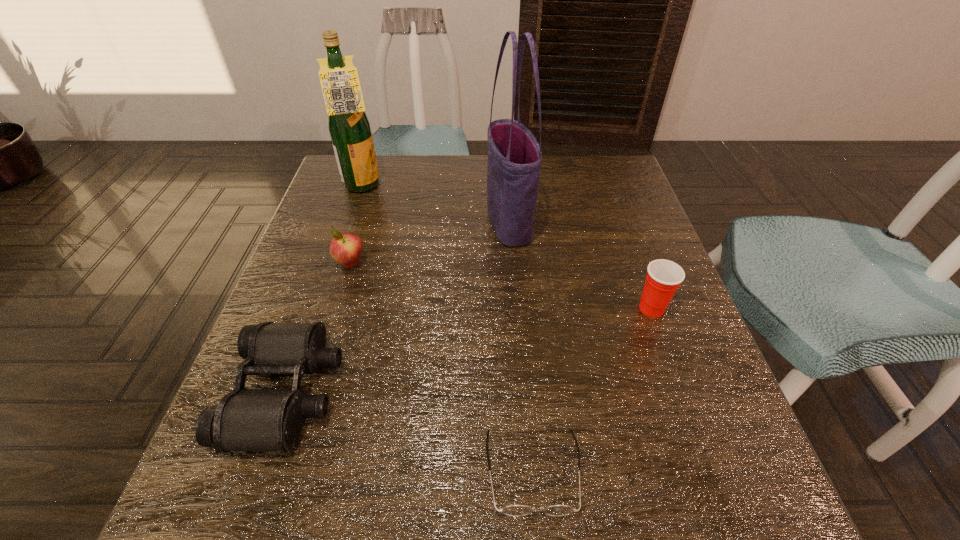
Where is `free location that satisfies the following two spatial constraints: 1. on the back side of the tote bag; 2. on the front-facing side of the liquor`? free location that satisfies the following two spatial constraints: 1. on the back side of the tote bag; 2. on the front-facing side of the liquor is located at coordinates (506, 187).

Find the location of a particular element. free point that satisfies the following two spatial constraints: 1. on the front-facing side of the liquor; 2. on the back side of the tote bag is located at coordinates (350, 224).